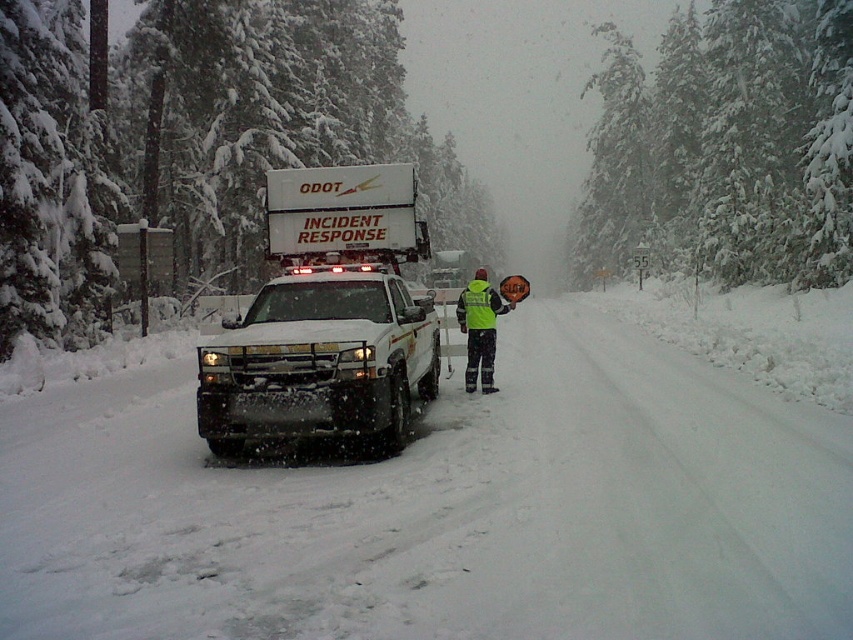
Does snow-covered evergreen at center appear over high-visibility yellow jacket at center?

Yes.

Which of these two, snow-covered evergreen at center or high-visibility yellow jacket at center, stands shorter?

Standing shorter between the two is high-visibility yellow jacket at center.

Find the location of a particular element. Image resolution: width=853 pixels, height=640 pixels. snow-covered evergreen at center is located at coordinates (727, 145).

Where is `snow-covered evergreen at center`? snow-covered evergreen at center is located at coordinates (727, 145).

Which is in front, point (622, 561) or point (654, 90)?

Point (622, 561) is more forward.

Between white fluffy snow at center and snow-covered evergreen at center, which one appears on the left side from the viewer's perspective?

white fluffy snow at center

Where is `white fluffy snow at center`? The image size is (853, 640). white fluffy snow at center is located at coordinates (442, 509).

Does snow-covered evergreen at left come in front of snow-covered evergreen at center?

Yes, snow-covered evergreen at left is closer to the viewer.

Between snow-covered evergreen at left and snow-covered evergreen at center, which one has less height?

snow-covered evergreen at left is shorter.

Is point (277, 81) positioned behind point (834, 54)?

Yes, point (277, 81) is farther from viewer.

The width and height of the screenshot is (853, 640). Find the location of `snow-covered evergreen at left`. snow-covered evergreen at left is located at coordinates (192, 141).